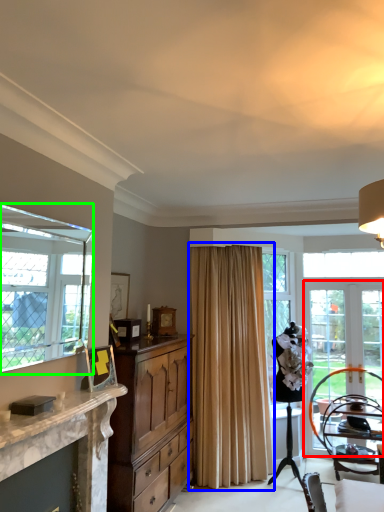
Question: Which is nearer to the screen door (highlighted by a red box)? curtain (highlighted by a blue box) or window (highlighted by a green box).

Choices:
 (A) curtain
 (B) window

Answer: (A)